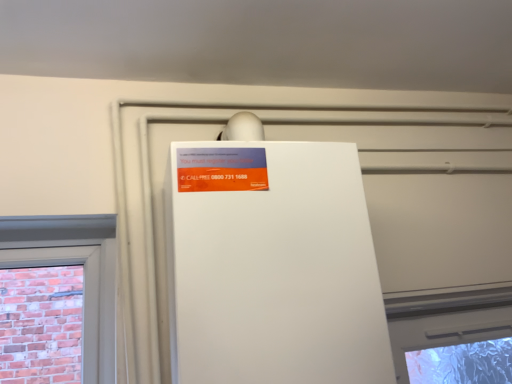
Question: Is white matte refrigerator at center inside orange matte sign at upper center?

Choices:
 (A) no
 (B) yes

Answer: (A)

Question: Is orange matte sign at upper center beside white matte refrigerator at center?

Choices:
 (A) no
 (B) yes

Answer: (A)

Question: Is orange matte sign at upper center positioned with its back to white matte refrigerator at center?

Choices:
 (A) yes
 (B) no

Answer: (A)

Question: From the image's perspective, is orange matte sign at upper center above white matte refrigerator at center?

Choices:
 (A) yes
 (B) no

Answer: (A)

Question: Is orange matte sign at upper center further to the viewer compared to white matte refrigerator at center?

Choices:
 (A) no
 (B) yes

Answer: (B)

Question: Could you tell me if orange matte sign at upper center is turned towards white matte refrigerator at center?

Choices:
 (A) yes
 (B) no

Answer: (A)

Question: Considering the relative sizes of white matte refrigerator at center and orange matte sign at upper center in the image provided, is white matte refrigerator at center smaller than orange matte sign at upper center?

Choices:
 (A) yes
 (B) no

Answer: (B)

Question: Does white matte refrigerator at center have a lesser height compared to orange matte sign at upper center?

Choices:
 (A) no
 (B) yes

Answer: (A)

Question: Is white matte refrigerator at center directly adjacent to orange matte sign at upper center?

Choices:
 (A) no
 (B) yes

Answer: (A)

Question: Does white matte refrigerator at center have a lesser width compared to orange matte sign at upper center?

Choices:
 (A) yes
 (B) no

Answer: (B)

Question: Is white matte refrigerator at center positioned before orange matte sign at upper center?

Choices:
 (A) no
 (B) yes

Answer: (B)

Question: Is white matte refrigerator at center positioned far away from orange matte sign at upper center?

Choices:
 (A) yes
 (B) no

Answer: (B)

Question: From a real-world perspective, is orange matte sign at upper center physically located above or below white matte refrigerator at center?

Choices:
 (A) above
 (B) below

Answer: (A)